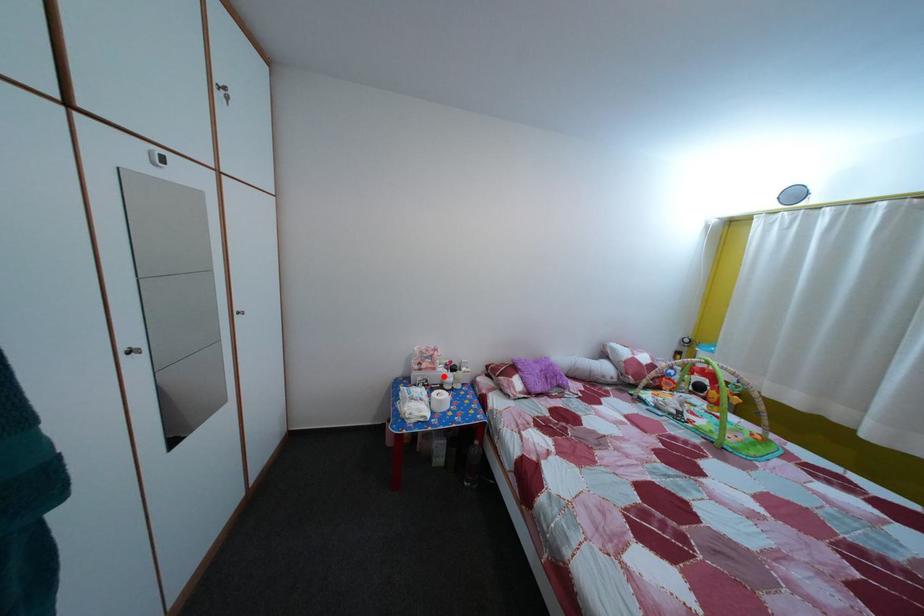
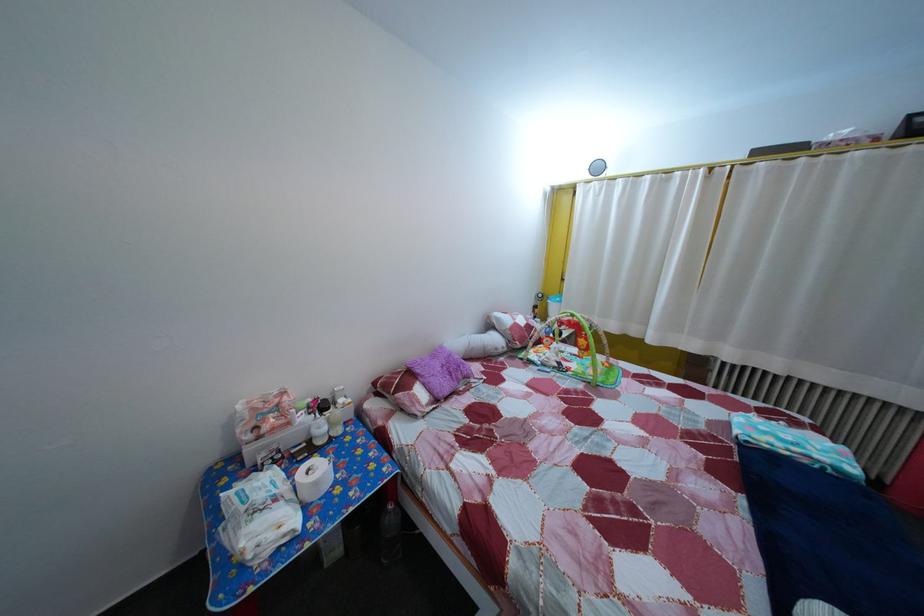
Where in the second image is the point corresponding to the highlighted location from the first image?

(298, 432)